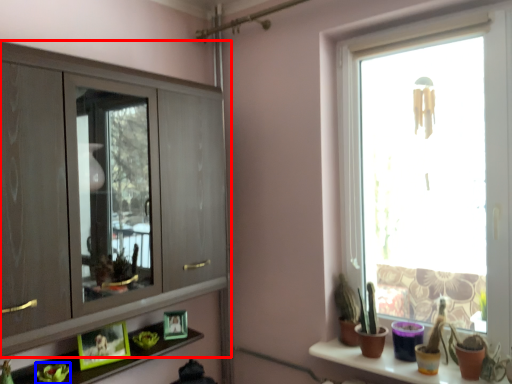
Question: Which point is closer to the camera, cupboard (highlighted by a red box) or plant (highlighted by a blue box)?

Choices:
 (A) cupboard
 (B) plant

Answer: (A)